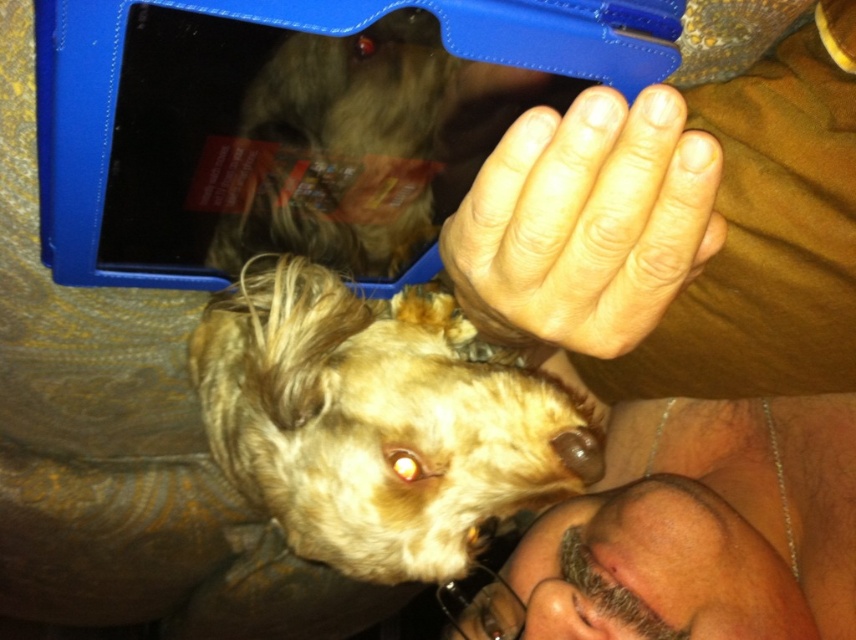
You are a photographer trying to capture the perfect shot of the person and the dog. You notice two points in the scene marked as point 1 at coordinates point (550, 497) and point 2 at coordinates point (292, 60). To ensure the subject is properly framed, you need to know which point is closer to the camera. Which point is closer?

Point (292, 60) is closer to the camera because it is in front of point (550, 497) according to the spatial description provided.